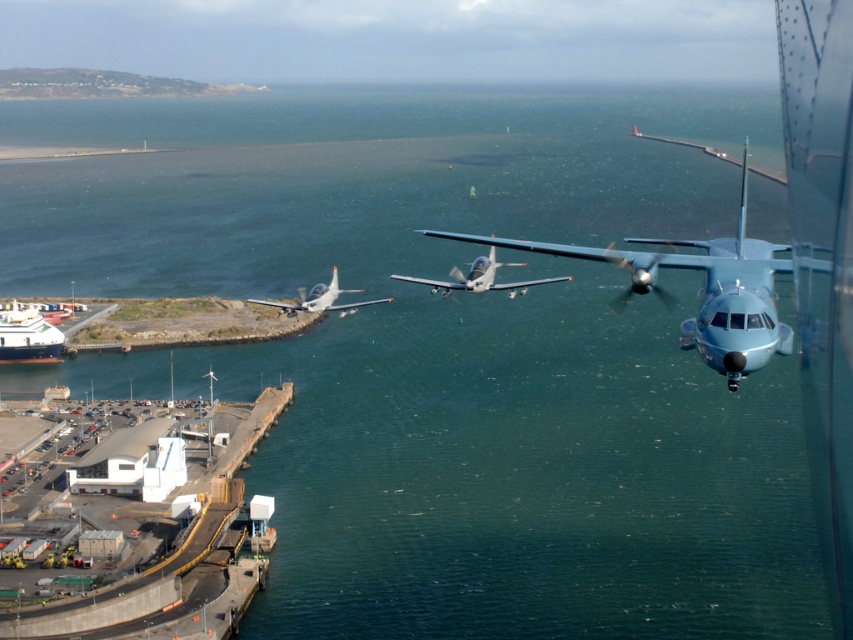
Can you confirm if metallic blue airplane at upper right is bigger than metallic gray airplane at center?

Correct, metallic blue airplane at upper right is larger in size than metallic gray airplane at center.

Who is more distant from viewer, (741, 164) or (451, 269)?

The point (741, 164) is more distant.

Locate an element on the screen. This screenshot has width=853, height=640. metallic blue airplane at upper right is located at coordinates (701, 289).

Is metallic blue airplane at upper right above silver metallic airplane at center?

Yes.

The image size is (853, 640). I want to click on metallic blue airplane at upper right, so click(x=701, y=289).

Measure the distance between point (605, 252) and camera.

1107.66 feet

You are a GUI agent. You are given a task and a screenshot of the screen. Output one action in this format:
    pyautogui.click(x=<x>, y=<y>)
    Task: Click on the metallic blue airplane at upper right
    The image size is (853, 640).
    Given the screenshot: What is the action you would take?
    pyautogui.click(x=701, y=289)

Which is above, metallic blue airplane at upper right or white glossy ship at lower left?

metallic blue airplane at upper right is above.

Who is more distant from viewer, (564, 250) or (22, 317)?

The point (22, 317) is behind.

Locate an element on the screen. metallic blue airplane at upper right is located at coordinates (701, 289).